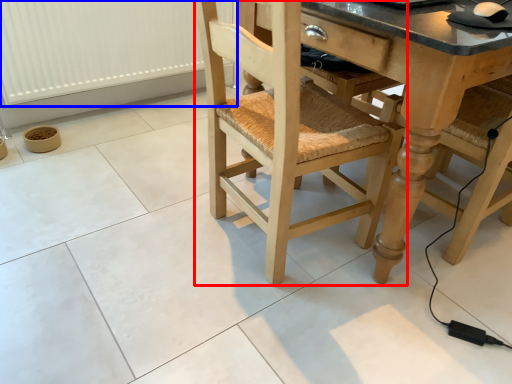
Question: Which of the following is the farthest to the observer, chair (highlighted by a red box) or radiator (highlighted by a blue box)?

Choices:
 (A) chair
 (B) radiator

Answer: (B)